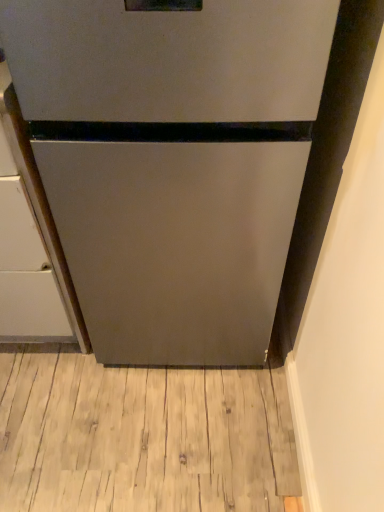
This screenshot has height=512, width=384. Describe the element at coordinates (172, 161) in the screenshot. I see `satin silver refrigerator at center` at that location.

Measure the distance between point [268,208] and camera.

36.61 inches.

Find the location of `satin silver refrigerator at center`. satin silver refrigerator at center is located at coordinates (172, 161).

From a real-world perspective, does satin silver cabinet at left sit lower than satin silver refrigerator at center?

Yes, from a real-world perspective, satin silver cabinet at left is under satin silver refrigerator at center.

Considering the sizes of objects satin silver cabinet at left and satin silver refrigerator at center in the image provided, who is smaller, satin silver cabinet at left or satin silver refrigerator at center?

With smaller size is satin silver cabinet at left.

Between satin silver cabinet at left and satin silver refrigerator at center, which one has smaller width?

With smaller width is satin silver refrigerator at center.

Considering the sizes of objects satin silver cabinet at left and satin silver refrigerator at center in the image provided, who is shorter, satin silver cabinet at left or satin silver refrigerator at center?

satin silver cabinet at left is shorter.

Is satin silver cabinet at left oriented away from light brown wood flooring at lower center?

No, satin silver cabinet at left is not facing the opposite direction of light brown wood flooring at lower center.

Which of these two, satin silver cabinet at left or light brown wood flooring at lower center, stands taller?

With more height is satin silver cabinet at left.

Are satin silver cabinet at left and light brown wood flooring at lower center beside each other?

No, satin silver cabinet at left is not with light brown wood flooring at lower center.

Is light brown wood flooring at lower center inside satin silver cabinet at left?

That's incorrect, light brown wood flooring at lower center is not inside satin silver cabinet at left.

Considering the sizes of objects satin silver refrigerator at center and light brown wood flooring at lower center in the image provided, who is bigger, satin silver refrigerator at center or light brown wood flooring at lower center?

Bigger between the two is satin silver refrigerator at center.

Which is correct: satin silver refrigerator at center is inside light brown wood flooring at lower center, or outside of it?

satin silver refrigerator at center is located beyond the bounds of light brown wood flooring at lower center.

Is satin silver refrigerator at center wider than light brown wood flooring at lower center?

Yes.

How different are the orientations of satin silver refrigerator at center and light brown wood flooring at lower center in degrees?

They differ by 0.859 degrees in their facing directions.

Is light brown wood flooring at lower center at the right side of satin silver cabinet at left?

Correct, you'll find light brown wood flooring at lower center to the right of satin silver cabinet at left.

Considering the relative sizes of light brown wood flooring at lower center and satin silver cabinet at left in the image provided, is light brown wood flooring at lower center thinner than satin silver cabinet at left?

Yes, light brown wood flooring at lower center is thinner than satin silver cabinet at left.

From a real-world perspective, is light brown wood flooring at lower center positioned over satin silver cabinet at left based on gravity?

No.

From the image's perspective, which is above, light brown wood flooring at lower center or satin silver cabinet at left?

satin silver cabinet at left, from the image's perspective.

Does satin silver refrigerator at center turn towards satin silver cabinet at left?

No, satin silver refrigerator at center is not aimed at satin silver cabinet at left.

Which point is more forward, (132, 173) or (33, 176)?

The point (132, 173) is closer.

Is satin silver refrigerator at center next to satin silver cabinet at left and touching it?

satin silver refrigerator at center and satin silver cabinet at left are clearly separated.

The width and height of the screenshot is (384, 512). Find the location of `refrigerator above the satin silver cabinet at left (from a real-world perspective)`. refrigerator above the satin silver cabinet at left (from a real-world perspective) is located at coordinates (172, 161).

This screenshot has width=384, height=512. Find the location of `refrigerator in front of the light brown wood flooring at lower center`. refrigerator in front of the light brown wood flooring at lower center is located at coordinates (172, 161).

Can satin silver refrigerator at center be found inside light brown wood flooring at lower center?

No, satin silver refrigerator at center is located outside of light brown wood flooring at lower center.

From the image's perspective, which is below, light brown wood flooring at lower center or satin silver refrigerator at center?

light brown wood flooring at lower center is shown below in the image.

Locate an element on the screen. cabinetry on the left of the satin silver refrigerator at center is located at coordinates (30, 244).

Where is `hardwood lying below the satin silver cabinet at left (from the image's perspective)`? hardwood lying below the satin silver cabinet at left (from the image's perspective) is located at coordinates (142, 437).

From the image, which object appears to be farther from satin silver refrigerator at center, light brown wood flooring at lower center or satin silver cabinet at left?

The object further to satin silver refrigerator at center is light brown wood flooring at lower center.

Based on their spatial positions, is satin silver cabinet at left or light brown wood flooring at lower center further from satin silver refrigerator at center?

light brown wood flooring at lower center is positioned further to the anchor satin silver refrigerator at center.

Considering their positions, is satin silver refrigerator at center positioned further to satin silver cabinet at left than light brown wood flooring at lower center?

light brown wood flooring at lower center is positioned further to the anchor satin silver cabinet at left.

Considering their positions, is satin silver cabinet at left positioned further to light brown wood flooring at lower center than satin silver refrigerator at center?

Among the two, satin silver refrigerator at center is located further to light brown wood flooring at lower center.

Consider the image. Estimate the real-world distances between objects in this image. Which object is further from satin silver cabinet at left, light brown wood flooring at lower center or satin silver refrigerator at center?

Based on the image, light brown wood flooring at lower center appears to be further to satin silver cabinet at left.

From the image, which object appears to be farther from light brown wood flooring at lower center, satin silver refrigerator at center or satin silver cabinet at left?

The object further to light brown wood flooring at lower center is satin silver refrigerator at center.

Locate an element on the screen. Image resolution: width=384 pixels, height=512 pixels. cabinetry between satin silver refrigerator at center and light brown wood flooring at lower center in the up-down direction is located at coordinates (30, 244).